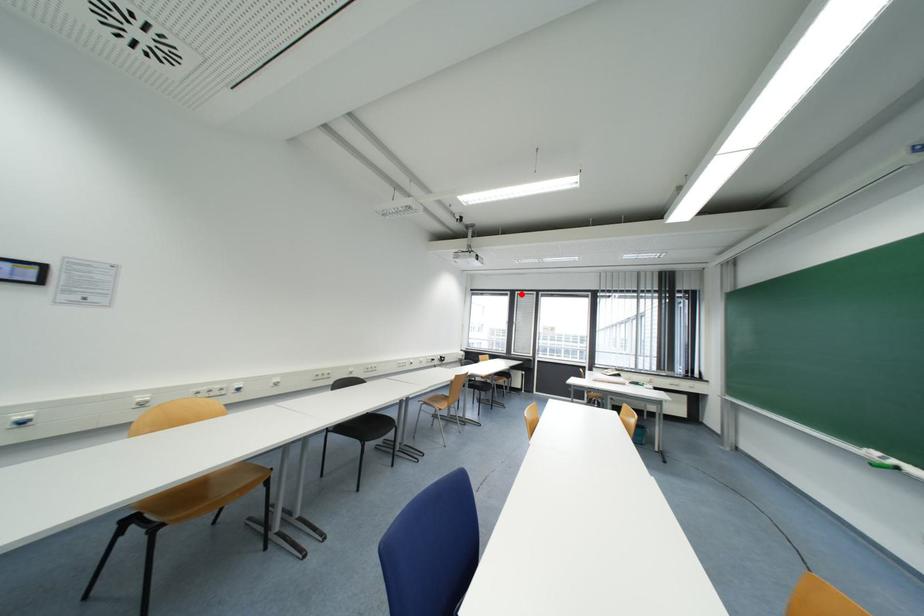
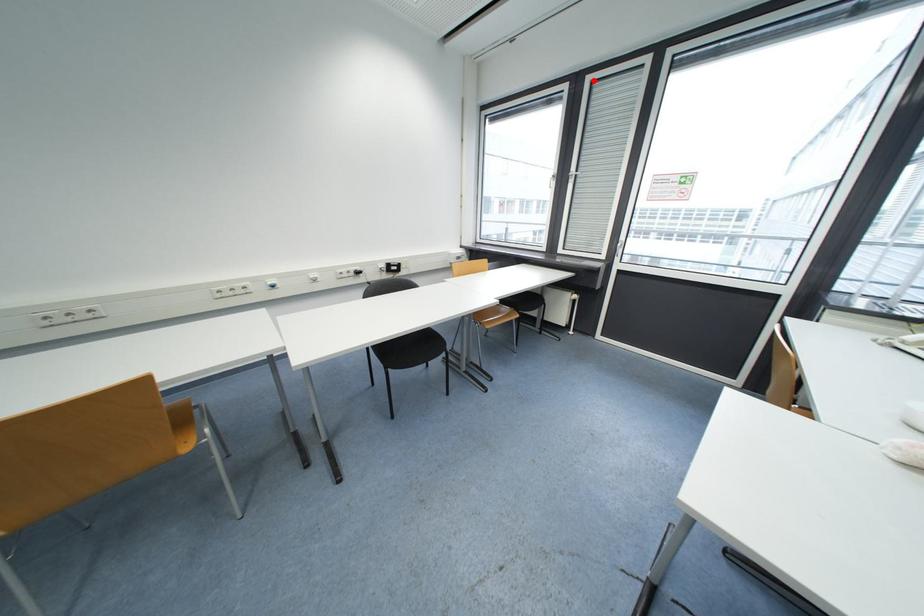
I am providing you with two images of the same scene from different viewpoints. A red point is marked on the first image and another point is marked on the second image. Is the red point in image1 aligned with the point shown in image2?

Yes